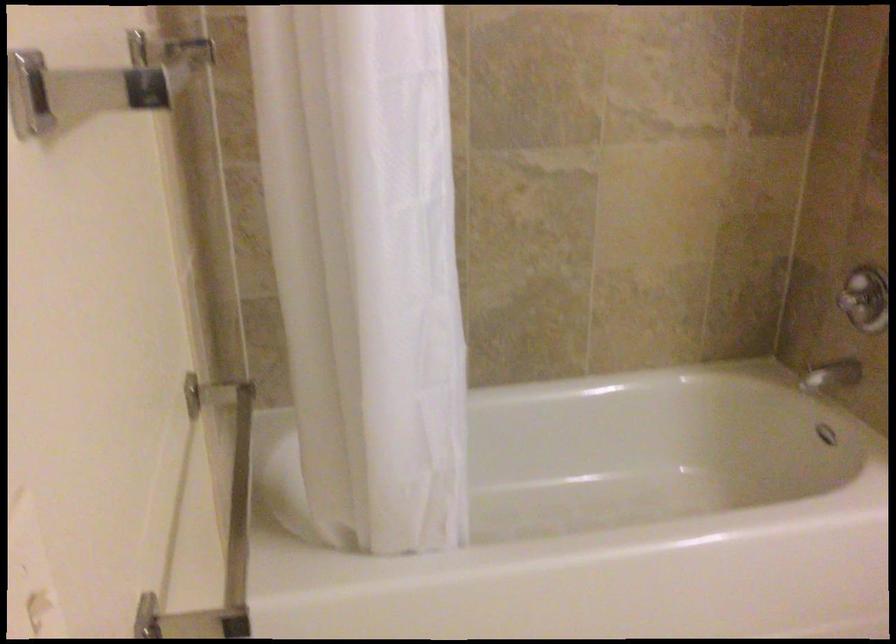
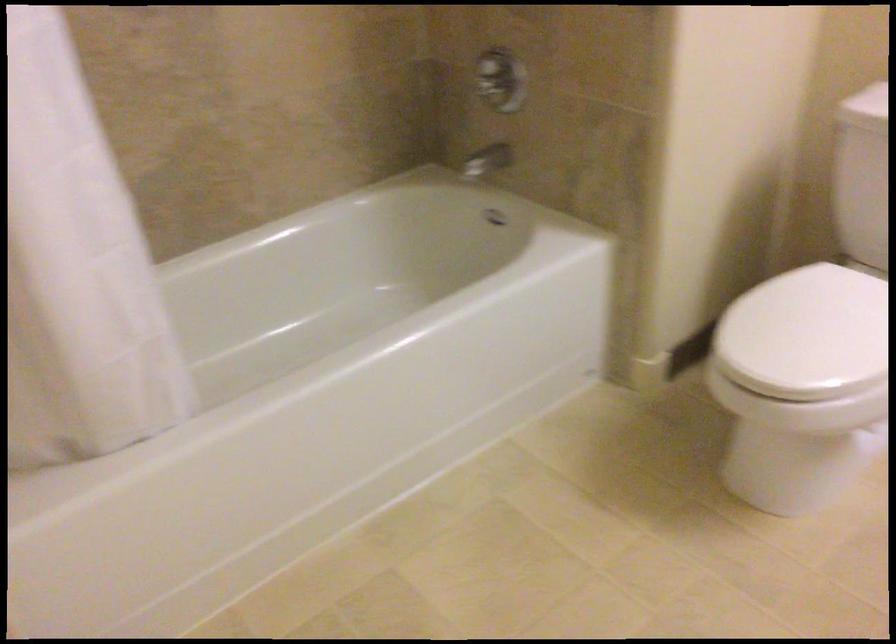
Question: Which direction would the cameraman need to move to produce the second image? Reply with the corresponding letter.

Choices:
 (A) Left
 (B) Right
 (C) Forward
 (D) Backward

Answer: (A)